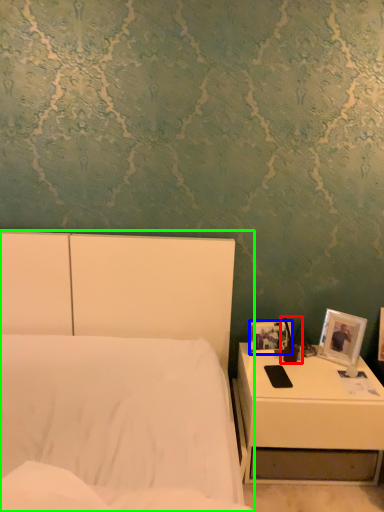
Question: Estimate the real-world distances between objects in this image. Which object is farther from bedside lamp (highlighted by a red box), picture frame (highlighted by a blue box) or bed (highlighted by a green box)?

Choices:
 (A) picture frame
 (B) bed

Answer: (B)